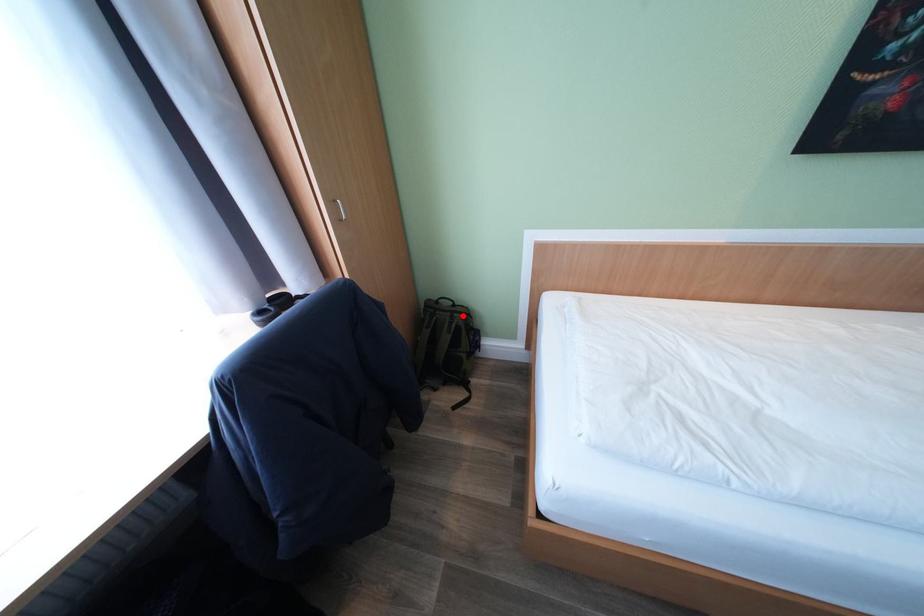
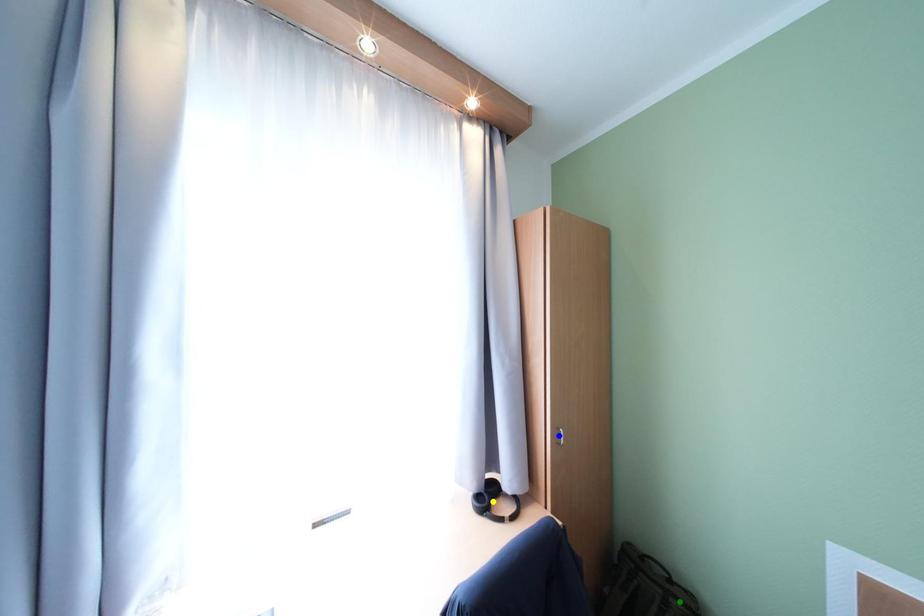
Question: I am providing you with two images of the same scene from different viewpoints. A red point is marked on the first image. You are given multiple points on the second image. In image 2, which mark is for the same physical point as the one in image 1?

Choices:
 (A) green point
 (B) yellow point
 (C) blue point

Answer: (A)